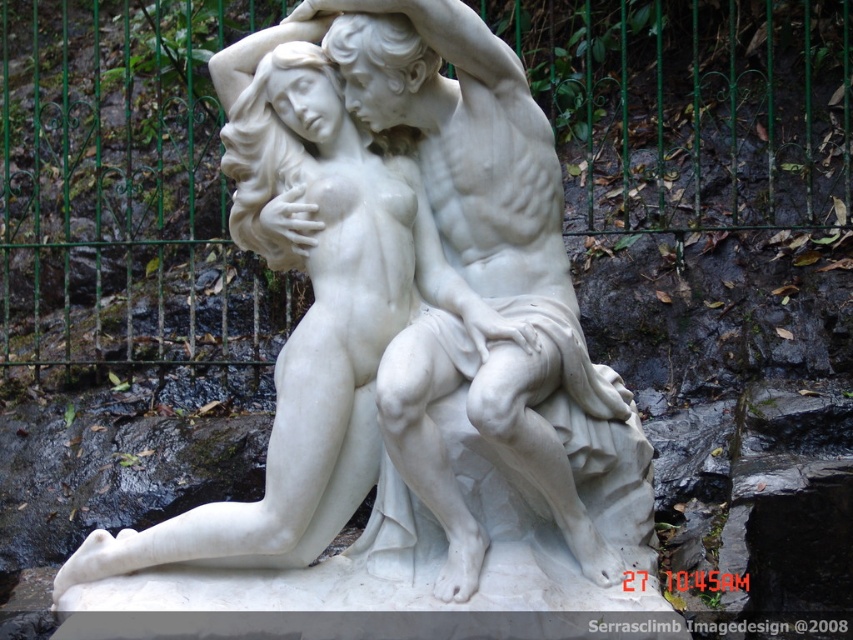
You are standing in front of the marble sculpture of the two figures. There is a green metal fence at upper center. Where exactly is the green metal fence located in relation to the sculpture?

The green metal fence at upper center is located at the coordinates point [122,188] relative to the sculpture.

You are standing in front of the white marble statue at center and want to touch the green metal fence at upper center. Which direction should you move to reach it?

The green metal fence at upper center is further to the viewer than the white marble statue at center, so you should move forward towards the green metal fence at upper center to reach it.

You are a photographer standing in front of the white marble statue at center and want to take a photo that includes the green metal fence at upper center in the background. Given that your camera has a maximum focus range of 25 meters, will you be able to capture both the statue and the fence clearly in the same shot?

The green metal fence at upper center is 24.89 meters from the white marble statue at center. Since the camera can focus up to 25 meters, the distance between them is within the camera range. Therefore, you can capture both the statue and the fence clearly in the same shot.